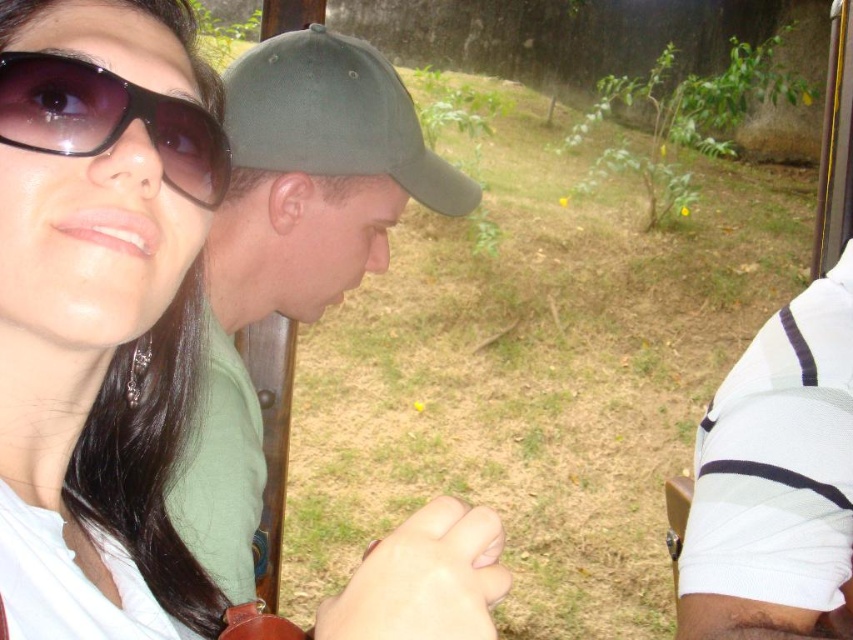
Question: Estimate the real-world distances between objects in this image. Which object is closer to the green matte cap at center?

Choices:
 (A) white striped shirt at right
 (B) matte black sunglasses at upper left
 (C) black matte sunglasses at upper left
 (D) green matte baseball cap at center

Answer: (D)

Question: Which of these objects is positioned closest to the green matte cap at center?

Choices:
 (A) matte black sunglasses at upper left
 (B) green matte baseball cap at center

Answer: (B)

Question: Does white striped shirt at right appear on the right side of matte black sunglasses at upper left?

Choices:
 (A) no
 (B) yes

Answer: (B)

Question: Does matte black sunglasses at upper left have a larger size compared to black matte sunglasses at upper left?

Choices:
 (A) yes
 (B) no

Answer: (A)

Question: Is green matte baseball cap at center wider than black matte sunglasses at upper left?

Choices:
 (A) no
 (B) yes

Answer: (B)

Question: Based on their relative distances, which object is farther from the matte black sunglasses at upper left?

Choices:
 (A) green matte cap at center
 (B) green matte baseball cap at center
 (C) black matte sunglasses at upper left
 (D) white striped shirt at right

Answer: (D)